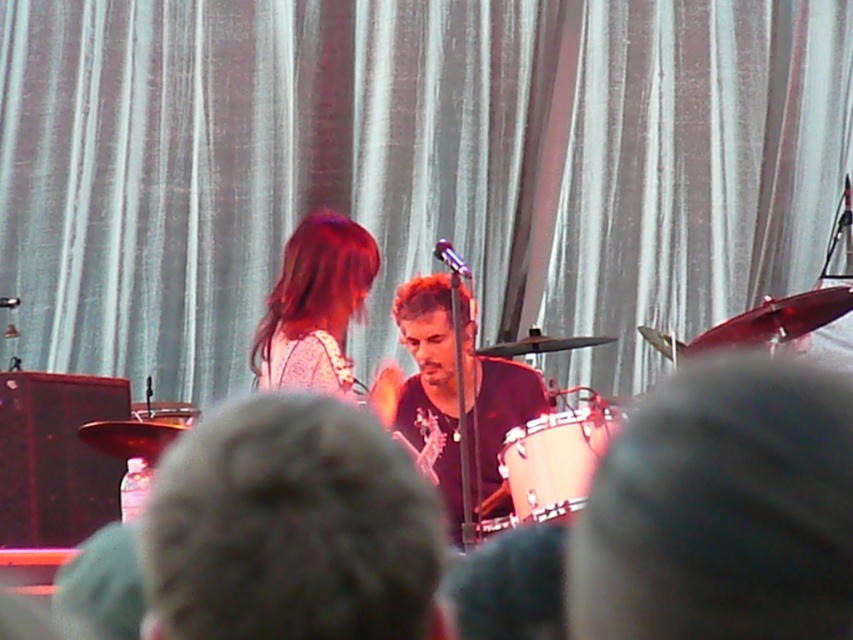
You are a photographer at a live music event. You need to capture a photo that includes both the black matte shirt at center and the matte white dress at center. Based on their positions, which one should you adjust your camera to focus on first to ensure both are in frame?

The black matte shirt at center is to the right of the matte white dress at center. To ensure both are in frame, focus on the matte white dress at center first since it is on the left, then adjust the camera to include the black matte shirt at center on the right.

You are a photographer setting up for a live music performance. You need to position your camera to capture the drummer and guitarist without the white fabric curtain at upper center blocking the view. Based on their positions, which musician should be closer to the camera to avoid the curtain?

The drummer is positioned slightly to the right and the guitarist is to the left. Since the white fabric curtain at upper center is at upper center, positioning the camera closer to the guitarist on the left would keep the curtain out of the frame. Alternatively, angling the camera downward might help avoid the curtain.